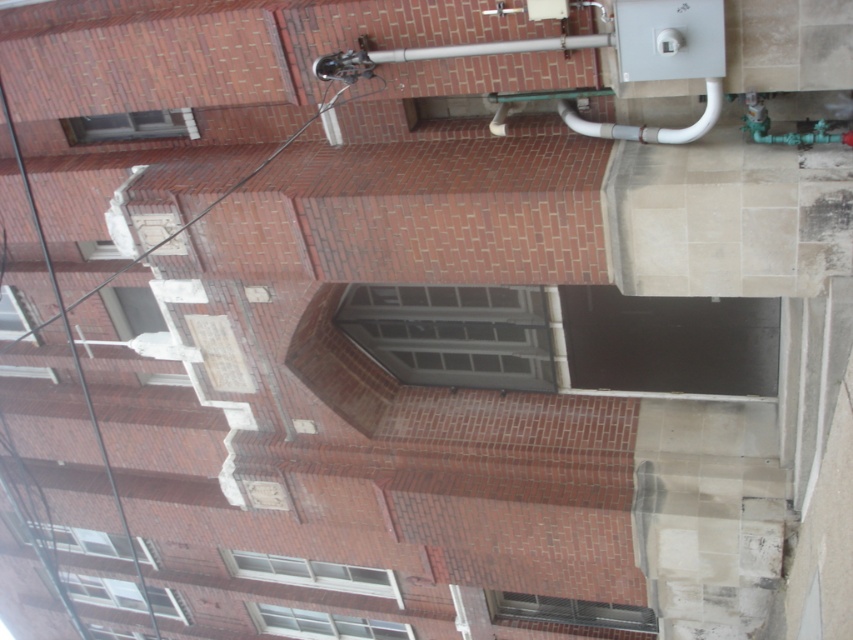
Between silver metallic pipe at upper center and white glossy pipe at upper right, which one is positioned higher?

Positioned higher is silver metallic pipe at upper center.

Does silver metallic pipe at upper center have a larger size compared to white glossy pipe at upper right?

Incorrect, silver metallic pipe at upper center is not larger than white glossy pipe at upper right.

Who is more distant from viewer, (x=566, y=49) or (x=699, y=125)?

The point (x=699, y=125) is more distant.

Where is `silver metallic pipe at upper center`? The image size is (853, 640). silver metallic pipe at upper center is located at coordinates (444, 52).